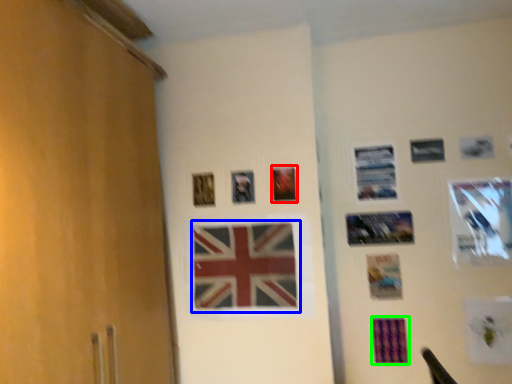
Question: Which is nearer to the picture frame (highlighted by a red box)? flag (highlighted by a blue box) or postcard (highlighted by a green box).

Choices:
 (A) flag
 (B) postcard

Answer: (A)